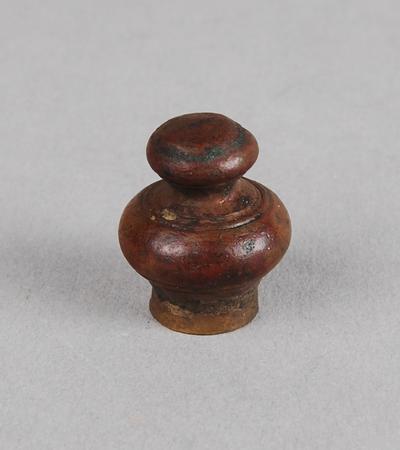
This screenshot has height=450, width=400. In order to click on knob in this screenshot , I will do `click(214, 256)`.